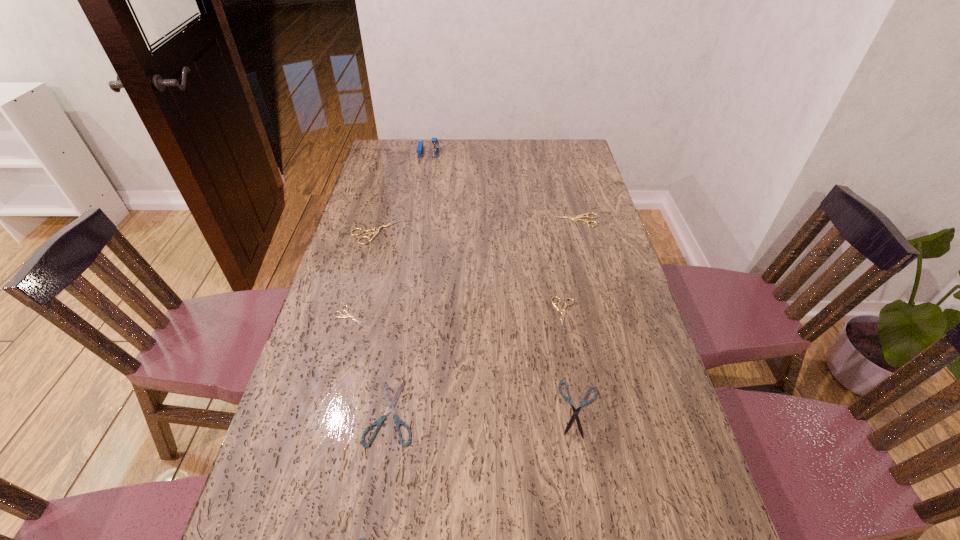
The height and width of the screenshot is (540, 960). I want to click on the farthest object, so click(x=419, y=150).

I want to click on blue stapler, so click(419, 150).

This screenshot has height=540, width=960. Find the location of `the tallest shears`. the tallest shears is located at coordinates (375, 230).

What are the coordinates of `the biggest beige shears` in the screenshot? It's located at (375, 230).

This screenshot has height=540, width=960. I want to click on the third smallest beige shears, so click(x=585, y=215).

Locate an element on the screen. The image size is (960, 540). the second tallest shears is located at coordinates click(585, 215).

This screenshot has height=540, width=960. Identify the location of the biggest black shears. (391, 404).

You are a GUI agent. You are given a task and a screenshot of the screen. Output one action in this format:
    pyautogui.click(x=<x>, y=<y>)
    Task: Click on the second smallest beige shears
    The width and height of the screenshot is (960, 540).
    Given the screenshot: What is the action you would take?
    pyautogui.click(x=558, y=308)

Locate an element on the screen. Image resolution: width=960 pixels, height=540 pixels. the rightmost black shears is located at coordinates (575, 411).

Identify the location of the smallest beige shears. The image size is (960, 540). (341, 315).